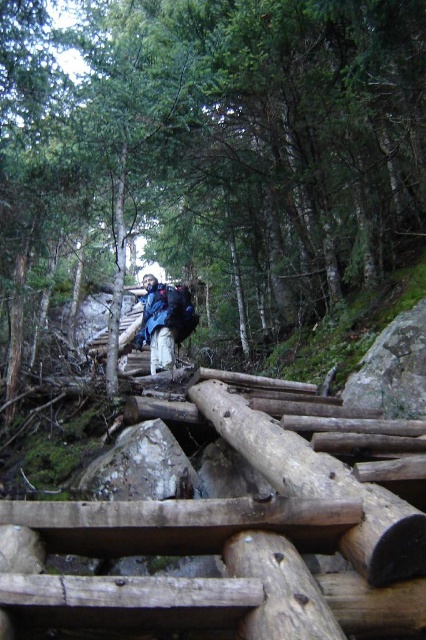
Is green matte tree at center wider than blue fabric backpack at center?

Indeed, green matte tree at center has a greater width compared to blue fabric backpack at center.

Which is in front, point (226, 97) or point (164, 358)?

Positioned in front is point (226, 97).

Identify the location of green matte tree at center. (216, 147).